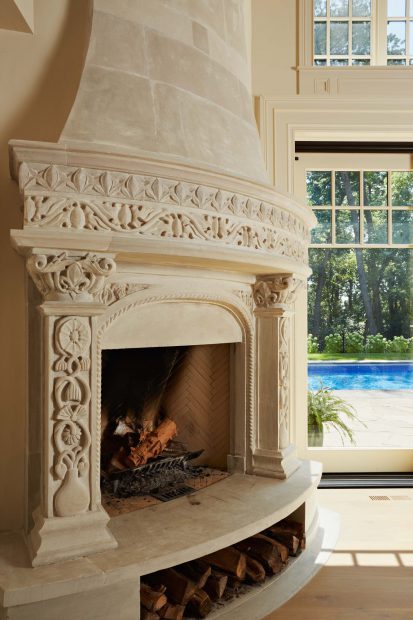
Locate an element on the screen. The image size is (413, 620). floor is located at coordinates (342, 507), (389, 514), (394, 590), (322, 601).